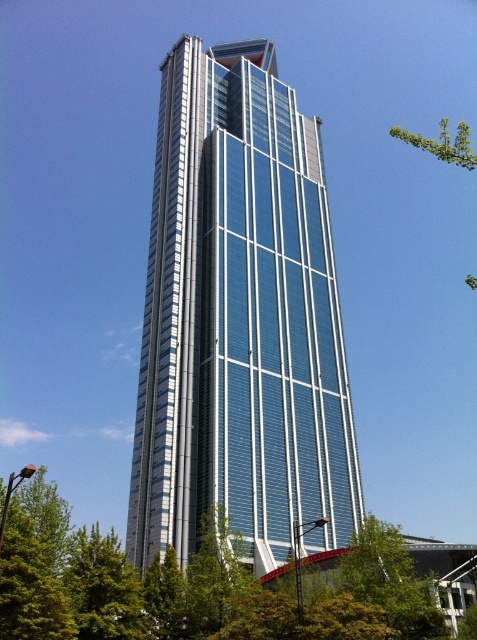
You are standing at the base of the shiny glass tower at center. You want to take a photo of the entire building without any obstructions. The camera you are using has a maximum zoom range of 100 feet. Can you capture the entire building in one shot without moving closer?

The shiny glass tower at center is 161.68 feet away from camera. Since the camera can only zoom up to 100 feet, you cannot capture the entire building in one shot without moving closer.

You are standing in front of the skyscraper and notice two points marked on the glass panels. The first point is at coordinates point (151, 515) and the second is at point (377, 556). Which point is closer to your position?

Point (151, 515) is further to the camera than point (377, 556), so the point closer to your position is point (377, 556).